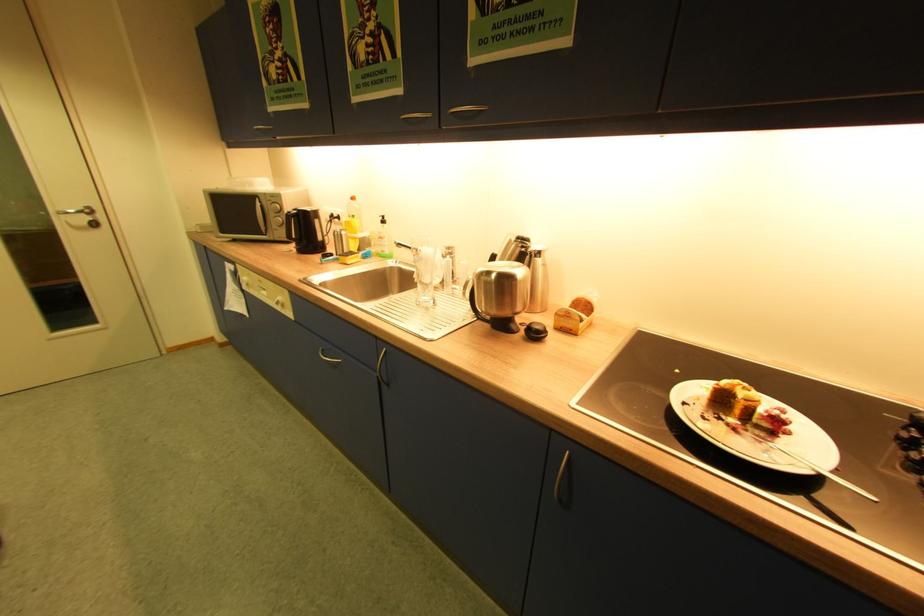
This screenshot has height=616, width=924. Describe the element at coordinates (78, 215) in the screenshot. I see `a silver door handle` at that location.